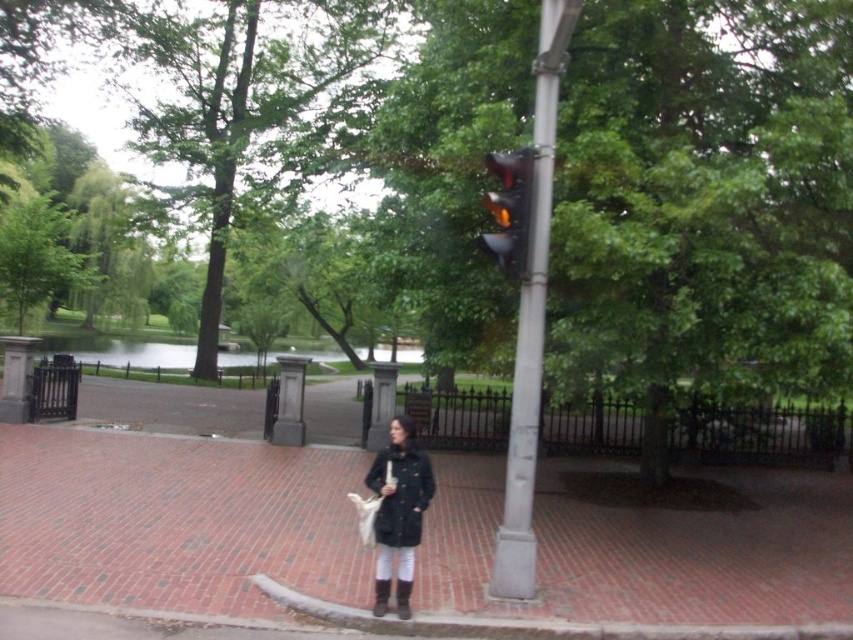
Question: Does brick pavement at center appear over yellow glass traffic light at upper center?

Choices:
 (A) yes
 (B) no

Answer: (B)

Question: Which of these objects is positioned farthest from the matte black coat at center?

Choices:
 (A) yellow glass traffic light at upper center
 (B) brick pavement at center
 (C) metallic gray traffic light at center

Answer: (B)

Question: Estimate the real-world distances between objects in this image. Which object is farther from the yellow glass traffic light at upper center?

Choices:
 (A) matte black coat at center
 (B) brick pavement at center

Answer: (B)

Question: Which point appears farthest from the camera in this image?

Choices:
 (A) (392, 556)
 (B) (526, 211)

Answer: (B)

Question: Can you confirm if matte black coat at center is smaller than yellow glass traffic light at upper center?

Choices:
 (A) yes
 (B) no

Answer: (B)

Question: Does matte black coat at center have a greater width compared to yellow glass traffic light at upper center?

Choices:
 (A) yes
 (B) no

Answer: (A)